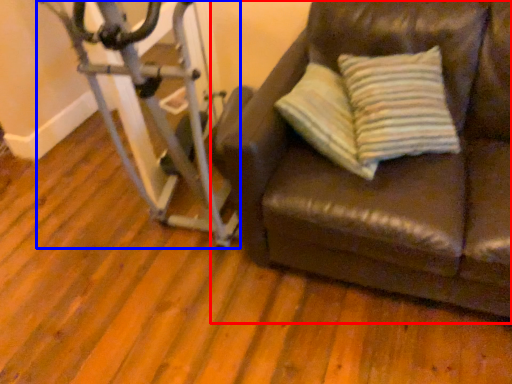
Question: Which point is closer to the camera, studio couch (highlighted by a red box) or stationary bicycle (highlighted by a blue box)?

Choices:
 (A) studio couch
 (B) stationary bicycle

Answer: (A)